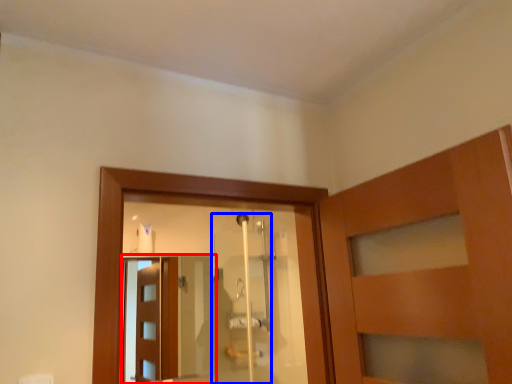
Question: Which of the following is the farthest to the observer, screen door (highlighted by a red box) or shower door (highlighted by a blue box)?

Choices:
 (A) screen door
 (B) shower door

Answer: (A)